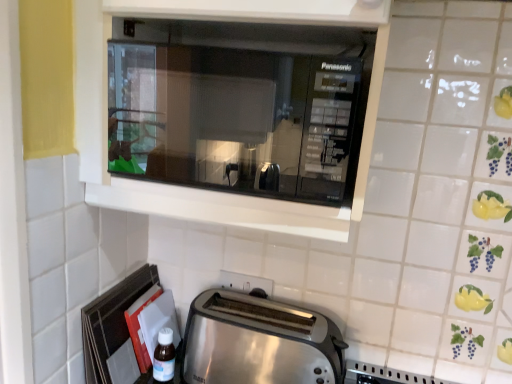
What are the coordinates of `satin silver toaster at lower center` in the screenshot? It's located at (258, 342).

What is the approximate height of transparent plastic bottle at lower left?

transparent plastic bottle at lower left is 13.09 centimeters tall.

What do you see at coordinates (203, 189) in the screenshot? I see `black glass microwave at upper center` at bounding box center [203, 189].

Image resolution: width=512 pixels, height=384 pixels. What are the coordinates of `satin silver toaster at lower center` in the screenshot? It's located at (258, 342).

Would you say satin silver toaster at lower center is to the left or to the right of black glass microwave at upper center in the picture?

satin silver toaster at lower center is positioned on black glass microwave at upper center's right side.

Considering the relative sizes of satin silver toaster at lower center and black glass microwave at upper center in the image provided, is satin silver toaster at lower center bigger than black glass microwave at upper center?

Actually, satin silver toaster at lower center might be smaller than black glass microwave at upper center.

Considering the relative sizes of satin silver toaster at lower center and black glass microwave at upper center in the image provided, is satin silver toaster at lower center thinner than black glass microwave at upper center?

Correct, the width of satin silver toaster at lower center is less than that of black glass microwave at upper center.

Between satin silver toaster at lower center and black glass microwave at upper center, which one has less height?

With less height is satin silver toaster at lower center.

Is transparent plastic bottle at lower left thinner than satin silver toaster at lower center?

Yes.

Which point is more forward, (161, 355) or (309, 310)?

Positioned in front is point (161, 355).

From the picture: Considering the sizes of transparent plastic bottle at lower left and satin silver toaster at lower center in the image, is transparent plastic bottle at lower left bigger or smaller than satin silver toaster at lower center?

In the image, transparent plastic bottle at lower left appears to be smaller than satin silver toaster at lower center.

Locate an element on the screen. cabinetry in front of the transparent plastic bottle at lower left is located at coordinates (203, 189).

Who is shorter, transparent plastic bottle at lower left or black glass microwave at upper center?

transparent plastic bottle at lower left is shorter.

From a real-world perspective, is transparent plastic bottle at lower left below black glass microwave at upper center?

Indeed, from a real-world perspective, transparent plastic bottle at lower left is positioned beneath black glass microwave at upper center.

Choose the correct answer: Is transparent plastic bottle at lower left inside black glass microwave at upper center or outside it?

transparent plastic bottle at lower left exists outside the volume of black glass microwave at upper center.

Which is correct: satin silver toaster at lower center is inside white plastic electric outlet at lower center, or outside of it?

The correct answer is: outside.

Between satin silver toaster at lower center and white plastic electric outlet at lower center, which one is positioned behind?

white plastic electric outlet at lower center is further away from the camera.

Which of these two, satin silver toaster at lower center or white plastic electric outlet at lower center, is wider?

With larger width is satin silver toaster at lower center.

Between point (248, 368) and point (269, 289), which one is positioned behind?

The point (269, 289) is farther.

Is white plastic electric outlet at lower center not close to satin silver toaster at lower center?

No, white plastic electric outlet at lower center is not far from satin silver toaster at lower center.

From a real-world perspective, is white plastic electric outlet at lower center positioned under satin silver toaster at lower center based on gravity?

Actually, white plastic electric outlet at lower center is physically above satin silver toaster at lower center in the real world.

Is white plastic electric outlet at lower center spatially inside satin silver toaster at lower center, or outside of it?

white plastic electric outlet at lower center is spatially situated outside satin silver toaster at lower center.

Is transparent plastic bottle at lower left turned away from white plastic electric outlet at lower center?

No, white plastic electric outlet at lower center is not at the back of transparent plastic bottle at lower left.

Is transparent plastic bottle at lower left not close to white plastic electric outlet at lower center?

No, transparent plastic bottle at lower left is in close proximity to white plastic electric outlet at lower center.

Considering the relative positions of transparent plastic bottle at lower left and white plastic electric outlet at lower center in the image provided, is transparent plastic bottle at lower left to the right of white plastic electric outlet at lower center from the viewer's perspective?

In fact, transparent plastic bottle at lower left is to the left of white plastic electric outlet at lower center.

Considering the sizes of objects transparent plastic bottle at lower left and white plastic electric outlet at lower center in the image provided, who is shorter, transparent plastic bottle at lower left or white plastic electric outlet at lower center?

white plastic electric outlet at lower center is shorter.

Based on the photo, is black glass microwave at upper center next to white plastic electric outlet at lower center?

There is a gap between black glass microwave at upper center and white plastic electric outlet at lower center.

From the image's perspective, does black glass microwave at upper center appear higher than white plastic electric outlet at lower center?

Yes, from the image's perspective, black glass microwave at upper center is over white plastic electric outlet at lower center.

In terms of width, does black glass microwave at upper center look wider or thinner when compared to white plastic electric outlet at lower center?

In the image, black glass microwave at upper center appears to be wider than white plastic electric outlet at lower center.

From a real-world perspective, is black glass microwave at upper center positioned under white plastic electric outlet at lower center based on gravity?

No.

Image resolution: width=512 pixels, height=384 pixels. I want to click on cabinetry above the satin silver toaster at lower center (from a real-world perspective), so click(x=203, y=189).

Locate an element on the screen. Image resolution: width=512 pixels, height=384 pixels. toaster in front of the transparent plastic bottle at lower left is located at coordinates (258, 342).

Based on the photo, looking at the image, which one is located further to satin silver toaster at lower center, white plastic electric outlet at lower center or black glass microwave at upper center?

black glass microwave at upper center lies further to satin silver toaster at lower center than the other object.

Based on their spatial positions, is satin silver toaster at lower center or black glass microwave at upper center further from transparent plastic bottle at lower left?

Among the two, black glass microwave at upper center is located further to transparent plastic bottle at lower left.

Considering their positions, is black glass microwave at upper center positioned closer to white plastic electric outlet at lower center than satin silver toaster at lower center?

satin silver toaster at lower center is positioned closer to the anchor white plastic electric outlet at lower center.

When comparing their distances from transparent plastic bottle at lower left, does white plastic electric outlet at lower center or black glass microwave at upper center seem closer?

Among the two, white plastic electric outlet at lower center is located nearer to transparent plastic bottle at lower left.

From the image, which object appears to be nearer to white plastic electric outlet at lower center, transparent plastic bottle at lower left or satin silver toaster at lower center?

satin silver toaster at lower center.

Which object lies further to the anchor point white plastic electric outlet at lower center, black glass microwave at upper center or transparent plastic bottle at lower left?

black glass microwave at upper center lies further to white plastic electric outlet at lower center than the other object.

Based on their spatial positions, is white plastic electric outlet at lower center or satin silver toaster at lower center further from black glass microwave at upper center?

white plastic electric outlet at lower center is further to black glass microwave at upper center.

Which object lies nearer to the anchor point black glass microwave at upper center, transparent plastic bottle at lower left or satin silver toaster at lower center?

Among the two, satin silver toaster at lower center is located nearer to black glass microwave at upper center.

Find the location of a particular element. electric outlet between black glass microwave at upper center and transparent plastic bottle at lower left in the vertical direction is located at coordinates (245, 282).

What are the coordinates of `electric outlet between black glass microwave at upper center and satin silver toaster at lower center in the vertical direction` in the screenshot? It's located at (245, 282).

Where is `toaster between black glass microwave at upper center and transparent plastic bottle at lower left from top to bottom`? The image size is (512, 384). toaster between black glass microwave at upper center and transparent plastic bottle at lower left from top to bottom is located at coordinates (258, 342).

Identify the location of bottle between satin silver toaster at lower center and white plastic electric outlet at lower center in the front-back direction. (x=164, y=357).